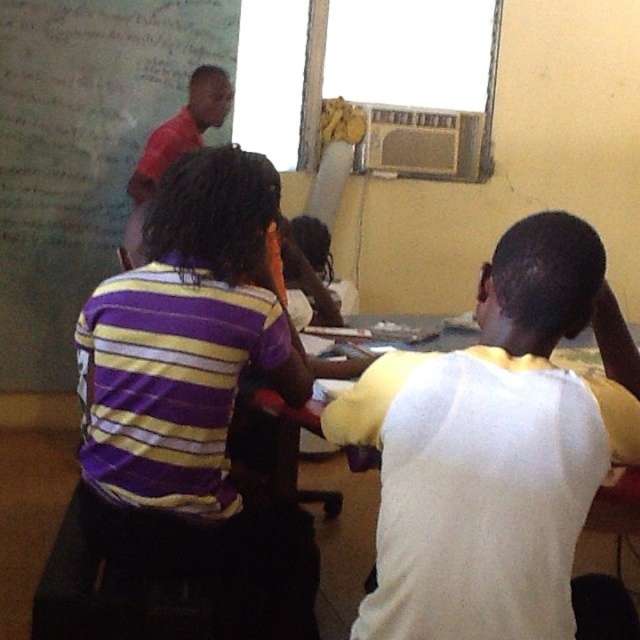
Is white/yellow raglan sleeve shirt at center thinner than red shirt at upper left?

Incorrect, white/yellow raglan sleeve shirt at center's width is not less than red shirt at upper left's.

Is point (580, 387) closer to camera compared to point (208, 104)?

Yes, point (580, 387) is closer to viewer.

Does point (509, 396) lie behind point (136, 188)?

No, it is not.

You are a GUI agent. You are given a task and a screenshot of the screen. Output one action in this format:
    pyautogui.click(x=<x>, y=<y>)
    Task: Click on the white/yellow raglan sleeve shirt at center
    Image resolution: width=640 pixels, height=640 pixels.
    Given the screenshot: What is the action you would take?
    pyautogui.click(x=493, y=448)

Is point (36, 186) positioned in front of point (225, 92)?

No.

Is point (104, 275) positioned after point (163, 154)?

That is True.

Where is `whiteboard at upper left`? This screenshot has width=640, height=640. whiteboard at upper left is located at coordinates (81, 150).

Is white/yellow raglan sleeve shirt at center positioned in front of whiteboard at upper left?

Yes, it is in front of whiteboard at upper left.

Between white/yellow raglan sleeve shirt at center and whiteboard at upper left, which one appears on the right side from the viewer's perspective?

From the viewer's perspective, white/yellow raglan sleeve shirt at center appears more on the right side.

The width and height of the screenshot is (640, 640). What are the coordinates of `white/yellow raglan sleeve shirt at center` in the screenshot? It's located at (493, 448).